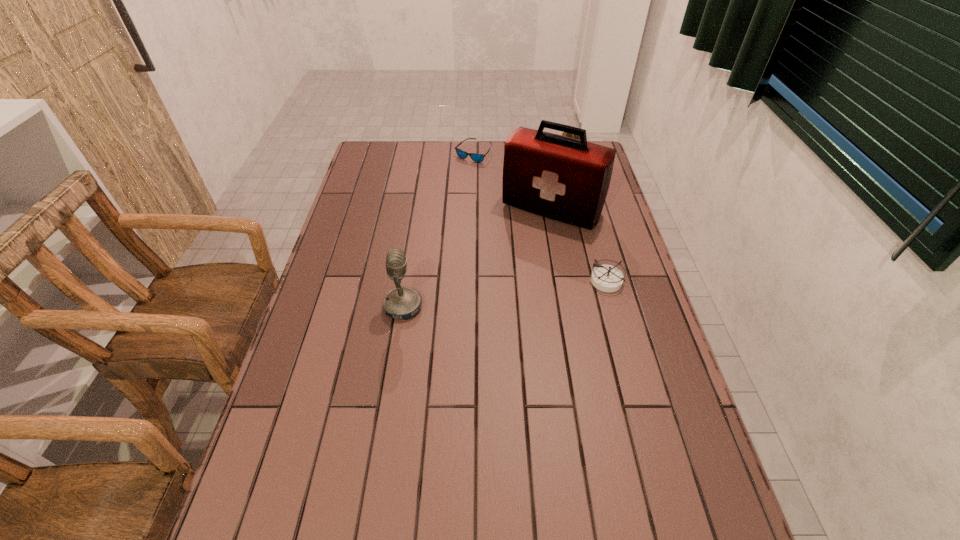
What are the coordinates of `free space on the desktop that is between the microphone and the shorter compass and is positioned at the front of the second object from left to right showing the lenses` in the screenshot? It's located at 516,292.

Identify the location of vacant space on the desktop that is between the fourth shortest object and the fourth tallest object and is positioned on the side of the first aid kit with the cross symbol. (496, 295).

The height and width of the screenshot is (540, 960). Find the location of `vacant space on the desktop that is between the leftmost object and the shorter compass and is positioned with the dial facing the taller compass`. vacant space on the desktop that is between the leftmost object and the shorter compass and is positioned with the dial facing the taller compass is located at coordinates (478, 297).